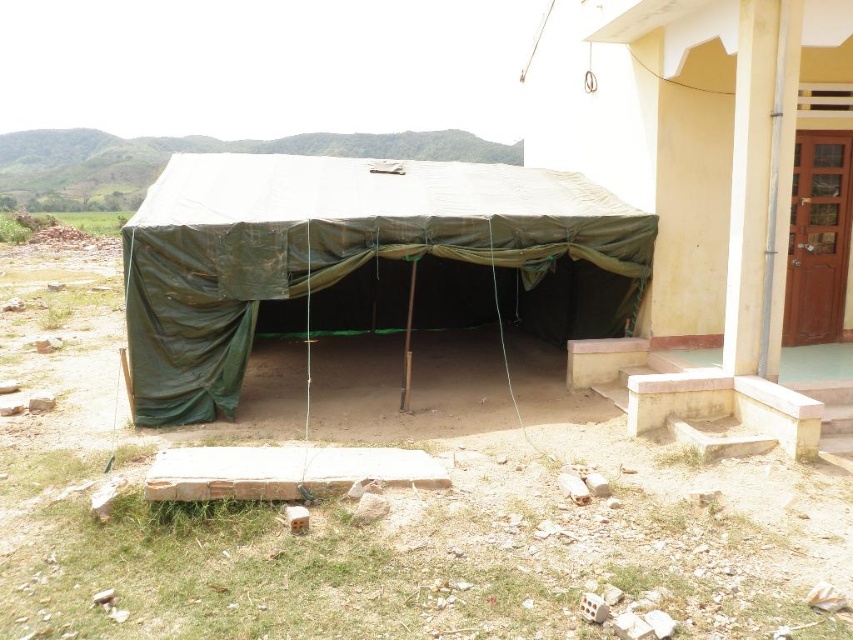
Question: Is green tarpaulin tent at lower left to the right of olive green tarpaulin tent at center from the viewer's perspective?

Choices:
 (A) yes
 (B) no

Answer: (A)

Question: Among these objects, which one is farthest from the camera?

Choices:
 (A) olive green tarpaulin tent at center
 (B) green tarpaulin tent at lower left

Answer: (A)

Question: Is green tarpaulin tent at lower left in front of olive green tarpaulin tent at center?

Choices:
 (A) yes
 (B) no

Answer: (A)

Question: Observing the image, what is the correct spatial positioning of green tarpaulin tent at lower left in reference to olive green tarpaulin tent at center?

Choices:
 (A) left
 (B) right

Answer: (B)

Question: Which object appears farthest from the camera in this image?

Choices:
 (A) green tarpaulin tent at lower left
 (B) olive green tarpaulin tent at center

Answer: (B)

Question: Among these points, which one is farthest from the camera?

Choices:
 (A) (466, 186)
 (B) (654, 76)

Answer: (A)